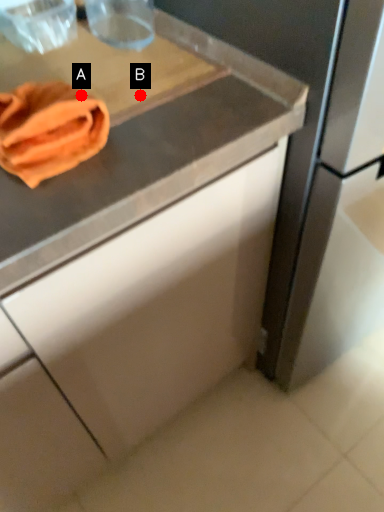
Question: Two points are circled on the image, labeled by A and B beside each circle. Among these points, which one is farthest from the camera?

Choices:
 (A) A is further
 (B) B is further

Answer: (B)